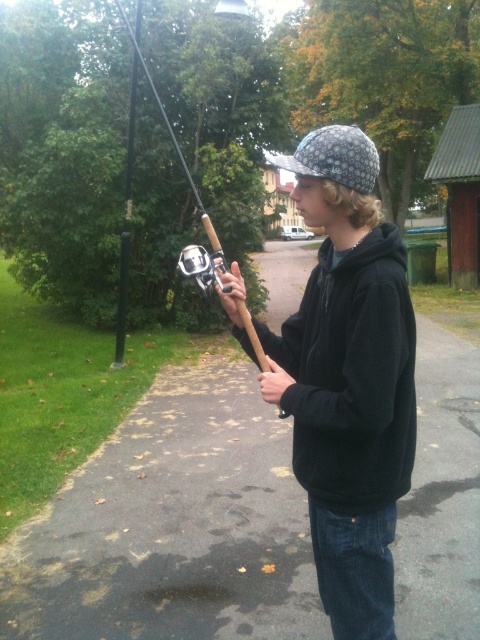
Who is positioned more to the left, matte black hoodie at center or black fleece sweatshirt at center?

black fleece sweatshirt at center

Describe the element at coordinates (348, 380) in the screenshot. This screenshot has height=640, width=480. I see `matte black hoodie at center` at that location.

Locate an element on the screen. This screenshot has width=480, height=640. matte black hoodie at center is located at coordinates (348, 380).

Is black fleece sweatshirt at center closer to the viewer compared to wooden fishing pole at center?

That is True.

Who is positioned more to the right, black fleece sweatshirt at center or wooden fishing pole at center?

Positioned to the right is black fleece sweatshirt at center.

The height and width of the screenshot is (640, 480). Describe the element at coordinates (351, 376) in the screenshot. I see `black fleece sweatshirt at center` at that location.

At what (x,y) coordinates should I click in order to perform the action: click on black fleece sweatshirt at center. Please return your answer as a coordinate pair (x, y). Looking at the image, I should click on click(x=351, y=376).

Is wet asphalt path at center bigger than wooden fishing pole at center?

Actually, wet asphalt path at center might be smaller than wooden fishing pole at center.

I want to click on wet asphalt path at center, so click(172, 525).